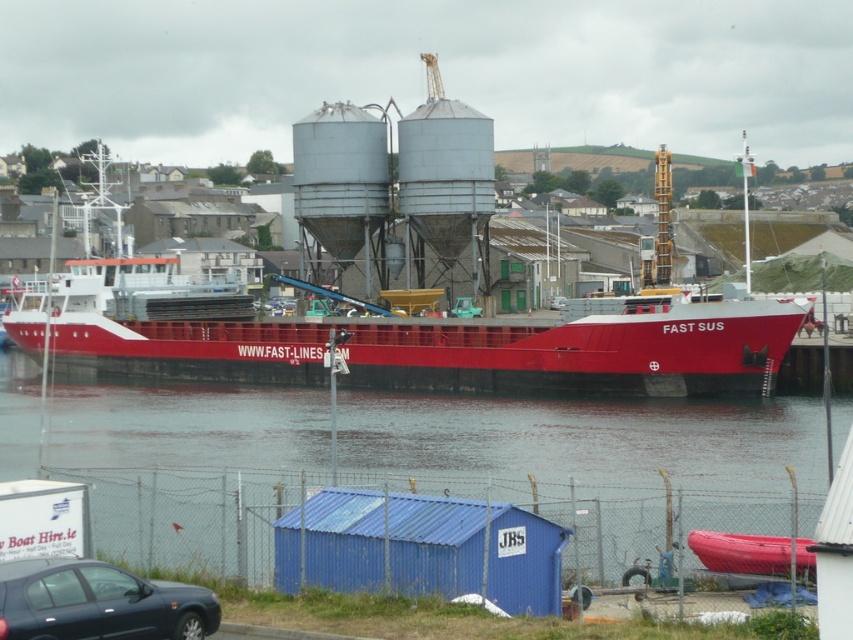
Which of these two, matte black car at lower left or rubberized red kayak at lower right, stands taller?

matte black car at lower left is taller.

Is matte black car at lower left taller than rubberized red kayak at lower right?

Yes, matte black car at lower left is taller than rubberized red kayak at lower right.

Who is more distant from viewer, [138,592] or [796,538]?

The point [796,538] is more distant.

Find the location of a particular element. The height and width of the screenshot is (640, 853). matte black car at lower left is located at coordinates (97, 602).

Does matte red ship at center appear on the right side of matte black car at lower left?

No, matte red ship at center is not to the right of matte black car at lower left.

You are a GUI agent. You are given a task and a screenshot of the screen. Output one action in this format:
    pyautogui.click(x=<x>, y=<y>)
    Task: Click on the matte red ship at center
    
    Given the screenshot: What is the action you would take?
    pyautogui.click(x=409, y=342)

Does point (587, 333) lie in front of point (33, 632)?

No.

You are a GUI agent. You are given a task and a screenshot of the screen. Output one action in this format:
    pyautogui.click(x=<x>, y=<y>)
    Task: Click on the matte red ship at center
    The width and height of the screenshot is (853, 640).
    Given the screenshot: What is the action you would take?
    pyautogui.click(x=409, y=342)

Does point (531, 467) come farther from viewer compared to point (755, 563)?

That is True.

Can you confirm if smooth water at center is positioned above rubberized red kayak at lower right?

Indeed, smooth water at center is positioned over rubberized red kayak at lower right.

Measure the distance between point (546, 483) and camera.

They are 25.81 meters apart.

Image resolution: width=853 pixels, height=640 pixels. Identify the location of smooth water at center. (593, 452).